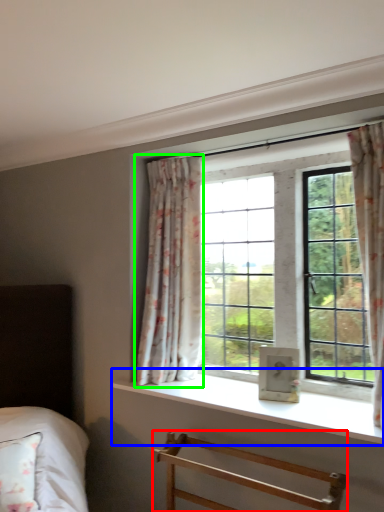
Question: Considering the real-world distances, which object is farthest from furniture (highlighted by a red box)? window sill (highlighted by a blue box) or curtain (highlighted by a green box)?

Choices:
 (A) window sill
 (B) curtain

Answer: (B)